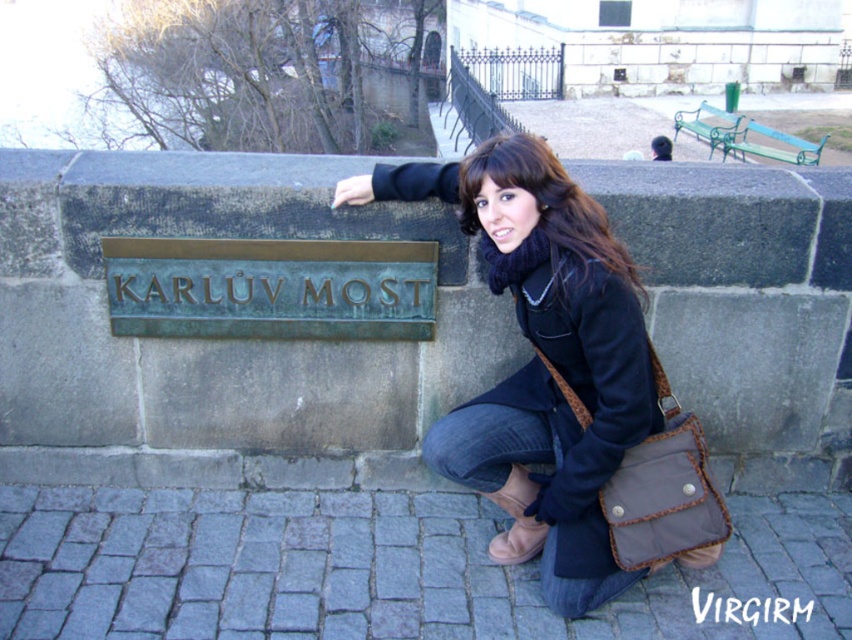
Question: Is bronze/kinetic sandblastedsign at center positioned at the back of matte black scarf at center?

Choices:
 (A) no
 (B) yes

Answer: (B)

Question: Considering the relative positions of bronze/kinetic sandblastedsign at center and matte black scarf at center in the image provided, where is bronze/kinetic sandblastedsign at center located with respect to matte black scarf at center?

Choices:
 (A) right
 (B) left

Answer: (B)

Question: Is bronze/kinetic sandblastedsign at center smaller than matte black scarf at center?

Choices:
 (A) yes
 (B) no

Answer: (A)

Question: Which object is the farthest from the matte black scarf at center?

Choices:
 (A) bronze/kinetic sandblastedsign at center
 (B) matte black coat at center

Answer: (A)

Question: Which object appears closest to the camera in this image?

Choices:
 (A) matte black coat at center
 (B) bronze/kinetic sandblastedsign at center

Answer: (A)

Question: Which object appears closest to the camera in this image?

Choices:
 (A) matte black scarf at center
 (B) matte black coat at center

Answer: (B)